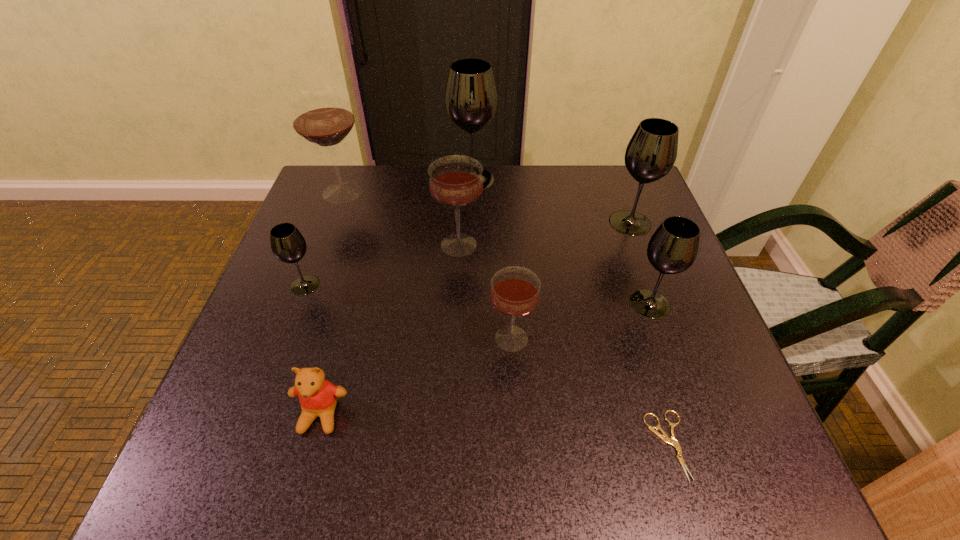
Identify the location of vacant space situated 0.070m on the left of the nearest red wineglass. (452, 338).

Find the location of a particular element. vacant space located on the right of the leftmost gray wineglass is located at coordinates (464, 285).

Where is `free space located on the left of the shortest object`? The image size is (960, 540). free space located on the left of the shortest object is located at coordinates (437, 445).

This screenshot has height=540, width=960. Identify the location of teddy bear that is positioned at the near edge. (318, 397).

Where is `shears positioned at the near edge`? shears positioned at the near edge is located at coordinates click(x=672, y=441).

Find the location of a particular element. This screenshot has width=960, height=540. teddy bear that is at the left edge is located at coordinates (318, 397).

Locate an element on the screen. The width and height of the screenshot is (960, 540). shears that is at the right edge is located at coordinates (672, 441).

You are a GUI agent. You are given a task and a screenshot of the screen. Output one action in this format:
    pyautogui.click(x=<x>, y=<y>)
    Task: Click on the object present at the far left corner
    The image size is (960, 540).
    Given the screenshot: What is the action you would take?
    pyautogui.click(x=322, y=115)

Find the location of a particular element. object present at the near left corner is located at coordinates [x=318, y=397].

Image resolution: width=960 pixels, height=540 pixels. What are the coordinates of `object situated at the far right corner` in the screenshot? It's located at (651, 153).